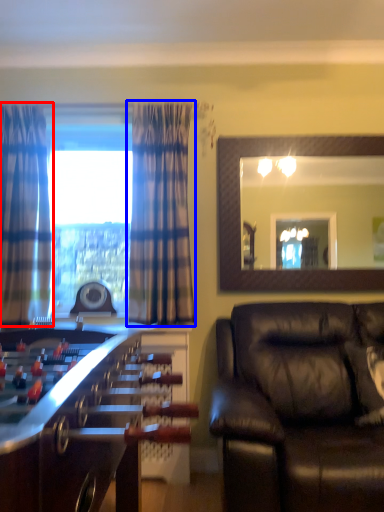
Question: Which object appears closest to the camera in this image, curtain (highlighted by a red box) or curtain (highlighted by a blue box)?

Choices:
 (A) curtain
 (B) curtain

Answer: (A)